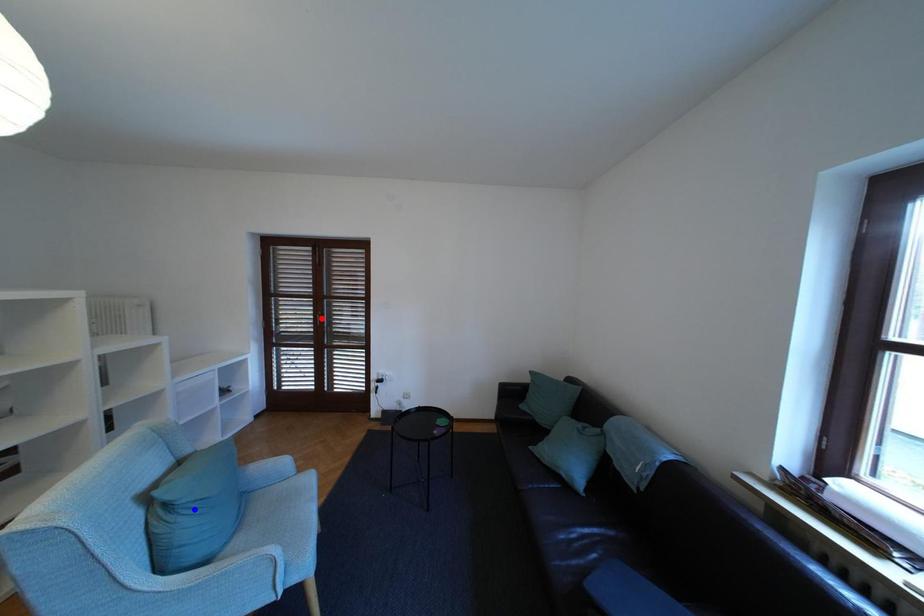
Question: Which of the two points in the image is closer to the camera?

Choices:
 (A) Blue point is closer.
 (B) Red point is closer.

Answer: (A)